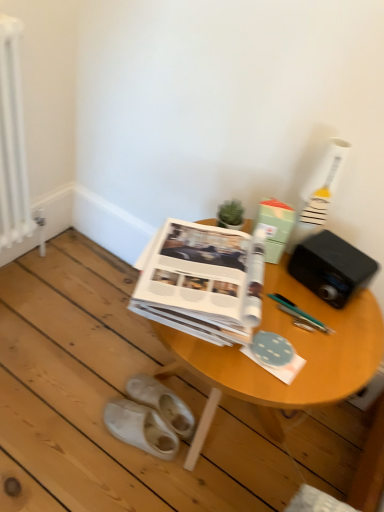
The image size is (384, 512). What are the coordinates of `vacant space situated above black plastic speaker at upper right (from a real-world perspective)` in the screenshot? It's located at (334, 248).